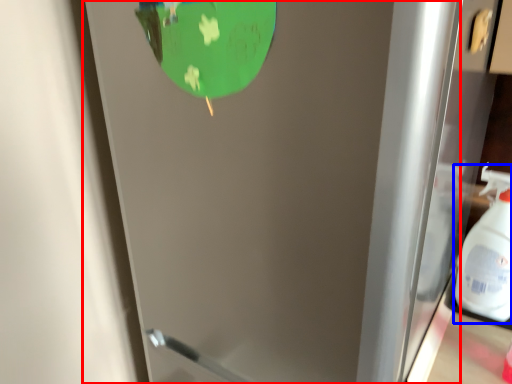
Question: Which of the following is the farthest to the observer, door (highlighted by a red box) or cleaning product (highlighted by a blue box)?

Choices:
 (A) door
 (B) cleaning product

Answer: (B)